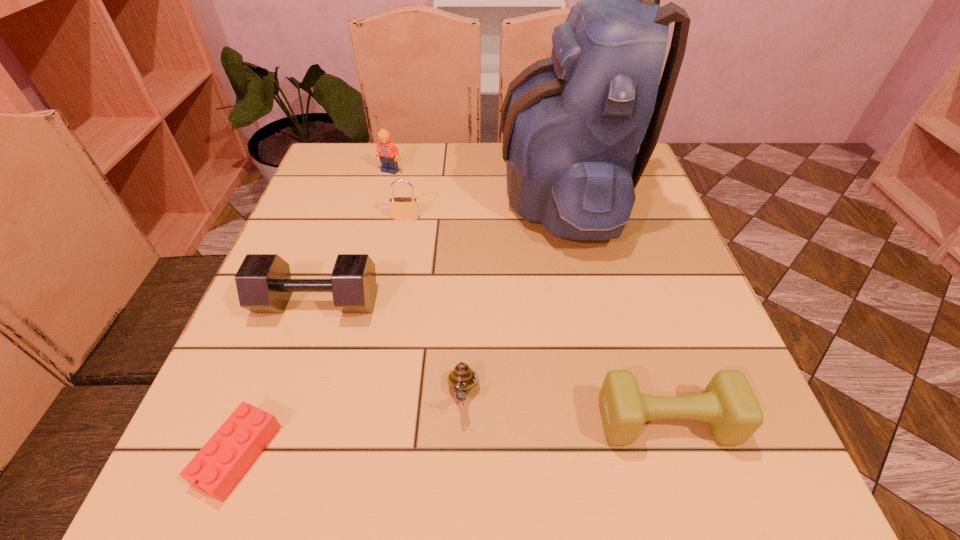
The width and height of the screenshot is (960, 540). Identify the location of free area in between the nearer dumbbell and the left dumbbell. (492, 362).

Locate an element on the screen. This screenshot has width=960, height=540. free spot between the right Lego and the padlock is located at coordinates [x=398, y=194].

Find the location of a particular element. This screenshot has height=540, width=960. vacant area between the shorter dumbbell and the fourth farthest object is located at coordinates pos(492,362).

Where is `free space between the nearer dumbbell and the farther Lego`? The image size is (960, 540). free space between the nearer dumbbell and the farther Lego is located at coordinates (528, 296).

The height and width of the screenshot is (540, 960). What are the coordinates of `blank region between the left dumbbell and the shorter Lego` in the screenshot? It's located at (277, 379).

The width and height of the screenshot is (960, 540). Identify the location of free space that is in between the nearer Lego and the left dumbbell. (277, 379).

Select which object appears as the second closest to the fifth object from left to right. Please provide its 2D coordinates. Your answer should be formatted as a tuple, i.e. [(x, y)], where the tuple contains the x and y coordinates of a point satisfying the conditions above.

[(728, 404)]

Locate which object is the second closest to the third object from right to left. Please provide its 2D coordinates. Your answer should be formatted as a tuple, i.e. [(x, y)], where the tuple contains the x and y coordinates of a point satisfying the conditions above.

[(728, 404)]

Identify the location of vacant space that satisfies the following two spatial constraints: 1. at the front pocket of the tallest object; 2. on the right side of the shorter dumbbell. (611, 421).

Find the location of a particular element. This screenshot has width=960, height=540. free spot that satisfies the following two spatial constraints: 1. at the front pocket of the tallest object; 2. on the back side of the shorter dumbbell is located at coordinates (611, 421).